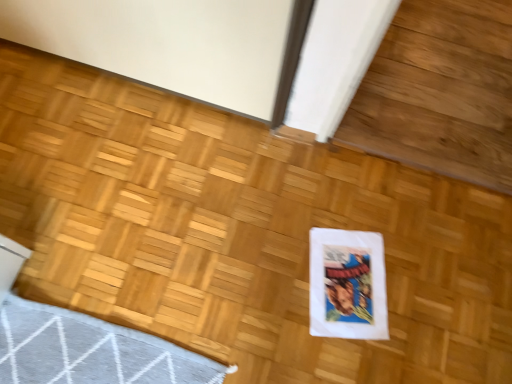
Locate an element on the screen. The image size is (512, 384). vacant region to the right of white paper comic book at lower right is located at coordinates (420, 297).